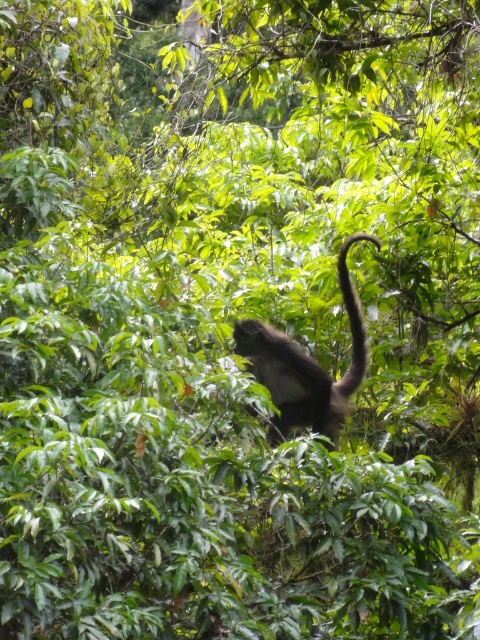
You are a hiker in the forest and see the brown furry monkey at center and the brown fuzzy tail at upper center. Which one is closer to you?

The brown furry monkey at center is closer to you because it is in front of the brown fuzzy tail at upper center.

You are an observer in the forest. You see a brown furry monkey at center and a brown fuzzy tail at upper center. Which object is positioned higher in the image?

The brown fuzzy tail at upper center is positioned higher in the image than the brown furry monkey at center.